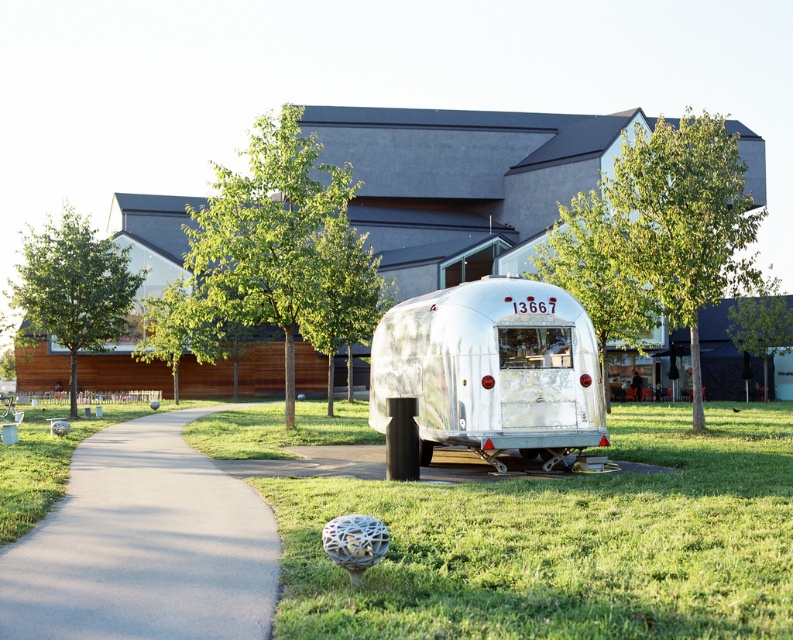
Question: Does green grass at center have a lesser width compared to gray asphalt pavement at center?

Choices:
 (A) yes
 (B) no

Answer: (B)

Question: Among these objects, which one is nearest to the camera?

Choices:
 (A) gray asphalt pavement at center
 (B) silver metallic trailer at center

Answer: (A)

Question: Is green grass at center to the left of silver metallic trailer at center from the viewer's perspective?

Choices:
 (A) yes
 (B) no

Answer: (B)

Question: Which point is closer to the camera?

Choices:
 (A) (557, 410)
 (B) (151, 438)
 (C) (650, 573)

Answer: (C)

Question: Which point is closer to the camera taking this photo?

Choices:
 (A) (186, 493)
 (B) (715, 445)

Answer: (A)

Question: Can you confirm if gray asphalt pavement at center is wider than silver metallic trailer at center?

Choices:
 (A) no
 (B) yes

Answer: (B)